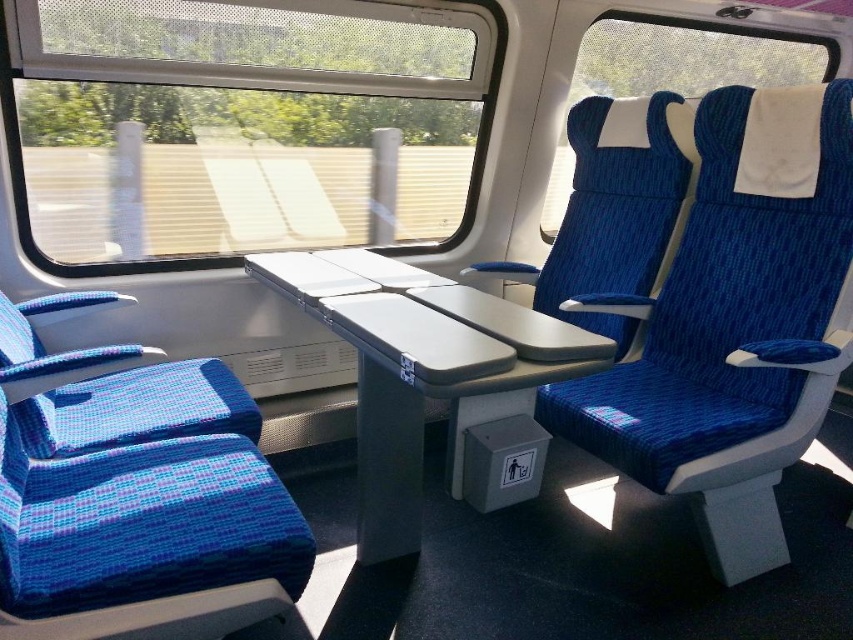
Is blue textured fabric seat at left wider than blue fabric chair at center?

Correct, the width of blue textured fabric seat at left exceeds that of blue fabric chair at center.

Does blue textured fabric seat at left have a greater height compared to blue fabric chair at center?

In fact, blue textured fabric seat at left may be shorter than blue fabric chair at center.

What do you see at coordinates (135, 497) in the screenshot? I see `blue textured fabric seat at left` at bounding box center [135, 497].

Where is `blue textured fabric seat at left`? Image resolution: width=853 pixels, height=640 pixels. blue textured fabric seat at left is located at coordinates (135, 497).

Between gray matte table at center and blue fabric chair at center, which one is positioned higher?

blue fabric chair at center is higher up.

This screenshot has width=853, height=640. Find the location of `gray matte table at center`. gray matte table at center is located at coordinates (422, 369).

The height and width of the screenshot is (640, 853). Identify the location of gray matte table at center. (422, 369).

The image size is (853, 640). I want to click on blue fabric seat at center, so click(x=737, y=324).

Which is below, blue fabric seat at center or blue textured fabric seat at left?

blue textured fabric seat at left is below.

Does point (779, 465) come farther from viewer compared to point (125, 392)?

No, it is in front of (125, 392).

You are a GUI agent. You are given a task and a screenshot of the screen. Output one action in this format:
    pyautogui.click(x=<x>, y=<y>)
    Task: Click on the blue fabric seat at center
    
    Given the screenshot: What is the action you would take?
    coord(737,324)